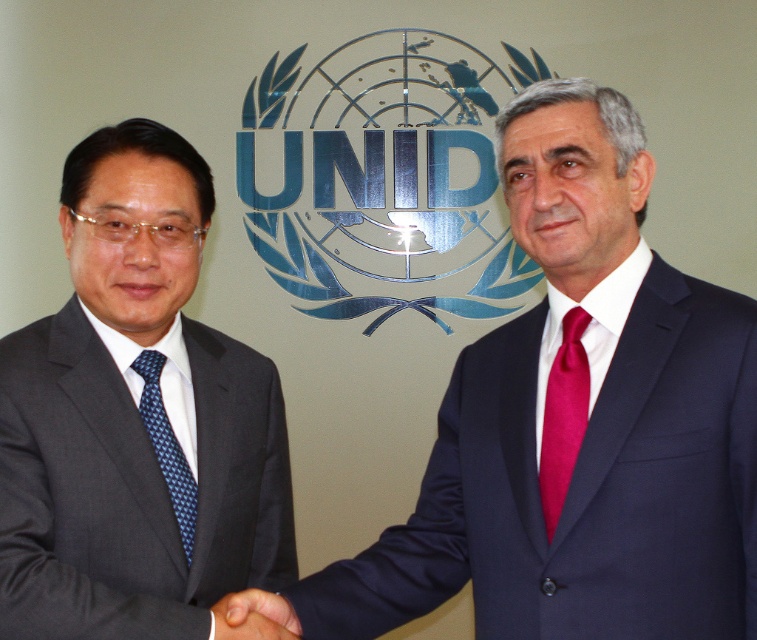
You are an event photographer at the UNID event. You need to capture a closeup shot of the blue dotted tie at left and the black matte hand at center. Which object should you focus on first if you want to ensure both are in focus without adjusting the camera settings?

The blue dotted tie at left is bigger than the black matte hand at center, so focusing on the blue dotted tie at left first would help ensure both are in focus since it is larger and easier to lock focus on.

You are a photographer at the UNID event and want to capture a closeup shot of the blue dotted tie at left and the black matte hand at center. Based on their sizes, which object would appear larger in the photo?

The black matte hand at center would appear larger in the photo since it is thicker than the blue dotted tie at left.

You are an event photographer at a UNID ceremony. You need to capture a photo where the matte black suit at left and the blue dotted tie at left are clearly visible. However, the logo is very reflective. Which object might be partially obscured by the reflection, and why?

The blue dotted tie at left might be partially obscured because the matte black suit at left is positioned over it, and the reflective logo could cause glare that covers the area where the tie is located.